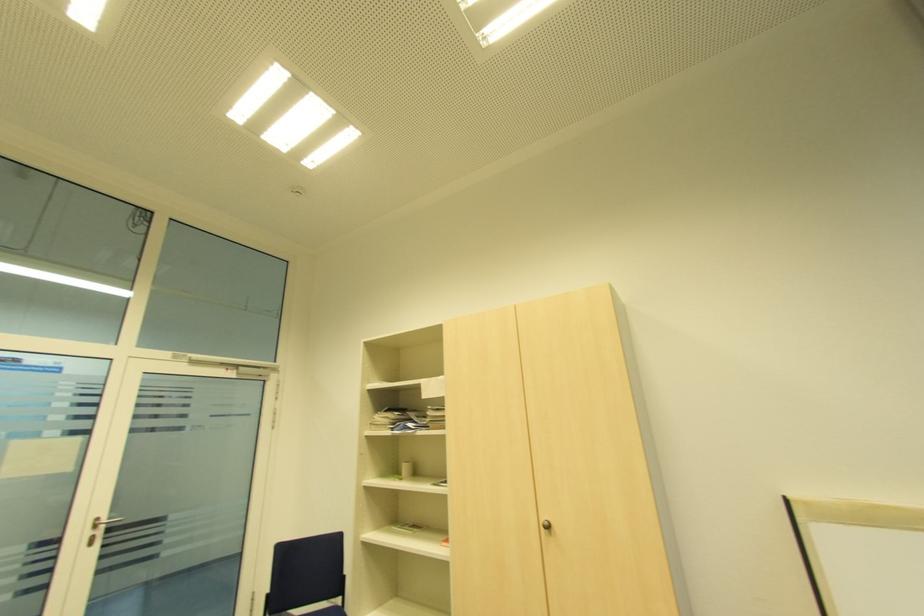
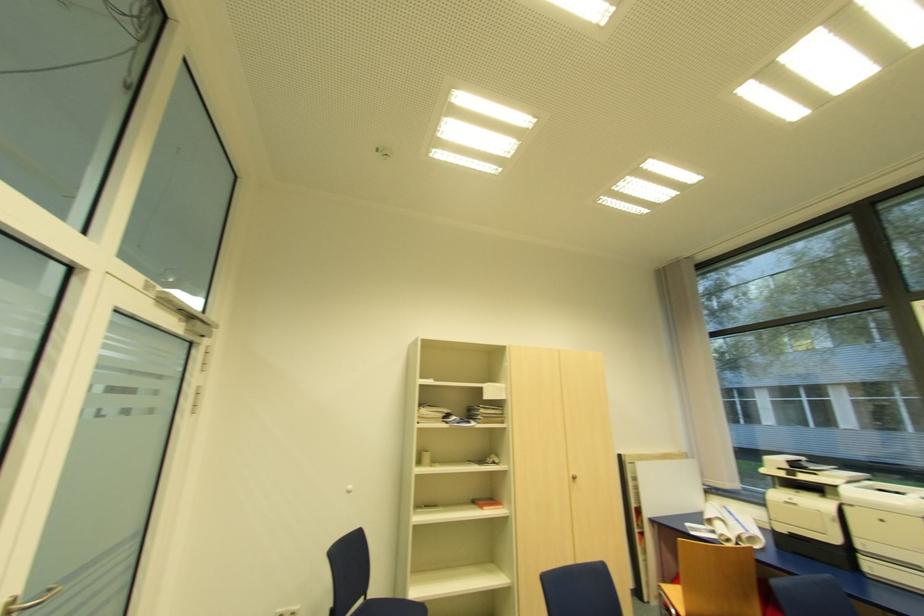
Where in the second image is the point corresponding to [550,527] from the first image?

(576, 477)